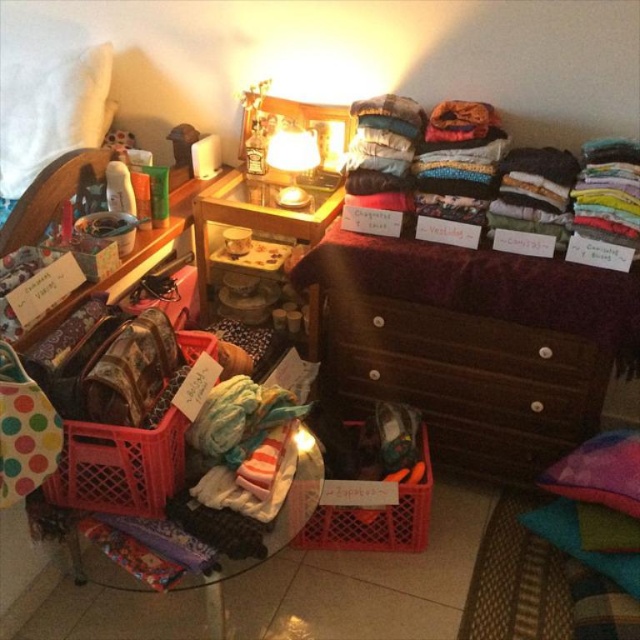
Question: Where is brown wooden dresser at center located in relation to translucent plastic basket at lower center in the image?

Choices:
 (A) left
 (B) right

Answer: (B)

Question: Is brown wooden dresser at center bigger than matte glass lamp at upper center?

Choices:
 (A) no
 (B) yes

Answer: (B)

Question: Which of the following is the farthest from the observer?

Choices:
 (A) [387, 541]
 (B) [605, 220]
 (C) [540, 433]

Answer: (C)

Question: Does brown wooden dresser at center have a larger size compared to multicolored fabric at upper right?

Choices:
 (A) no
 (B) yes

Answer: (B)

Question: Which of the following is the closest to the observer?

Choices:
 (A) matte glass lamp at upper center
 (B) multicolored fabric at upper right

Answer: (B)

Question: Which object is farther from the camera taking this photo?

Choices:
 (A) translucent plastic basket at lower center
 (B) multicolored fabric at upper right
 (C) brown wooden dresser at center
 (D) translucent plastic basket at lower left

Answer: (A)